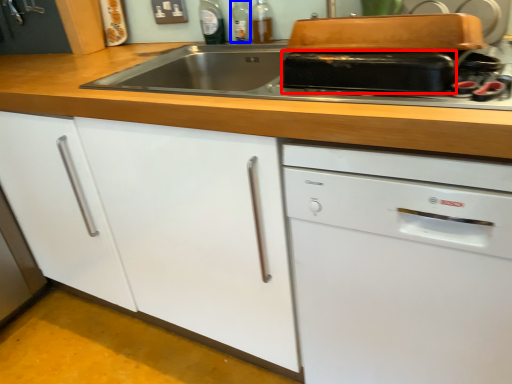
Question: Which object is further to the camera taking this photo, kitchen appliance (highlighted by a red box) or bottle (highlighted by a blue box)?

Choices:
 (A) kitchen appliance
 (B) bottle

Answer: (B)